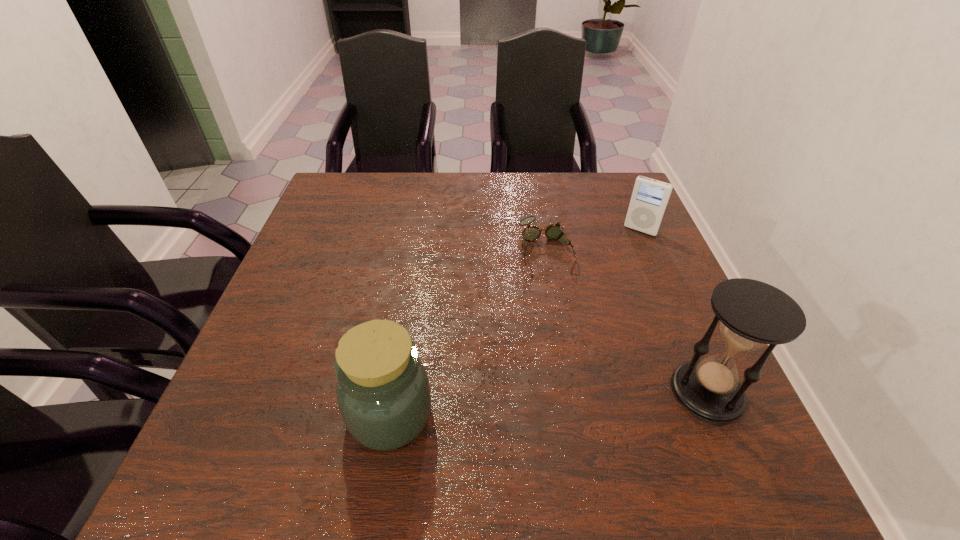
Find the location of a particular element. The width and height of the screenshot is (960, 540). unoccupied position between the tallest object and the jar is located at coordinates pos(549,403).

Image resolution: width=960 pixels, height=540 pixels. I want to click on vacant space that's between the shortest object and the second tallest object, so coord(468,333).

Where is `vacant space in between the iPod and the tallest object`? This screenshot has height=540, width=960. vacant space in between the iPod and the tallest object is located at coordinates (674, 311).

At what (x,y) coordinates should I click in order to perform the action: click on free space between the tallest object and the second shortest object. Please return your answer as a coordinate pair (x, y). The width and height of the screenshot is (960, 540). Looking at the image, I should click on (674, 311).

Where is `the second closest object to the second shortest object`? the second closest object to the second shortest object is located at coordinates (752, 313).

Locate an element on the screen. The width and height of the screenshot is (960, 540). the closest object to the spectacles is located at coordinates (650, 197).

Find the location of a particular element. The image size is (960, 540). vacant region that satisfies the following two spatial constraints: 1. on the back side of the tallest object; 2. on the left side of the iPod is located at coordinates (637, 230).

Where is `free location that satisfies the following two spatial constraints: 1. on the back side of the leftmost object; 2. on the right side of the hourglass`? The height and width of the screenshot is (540, 960). free location that satisfies the following two spatial constraints: 1. on the back side of the leftmost object; 2. on the right side of the hourglass is located at coordinates pos(394,392).